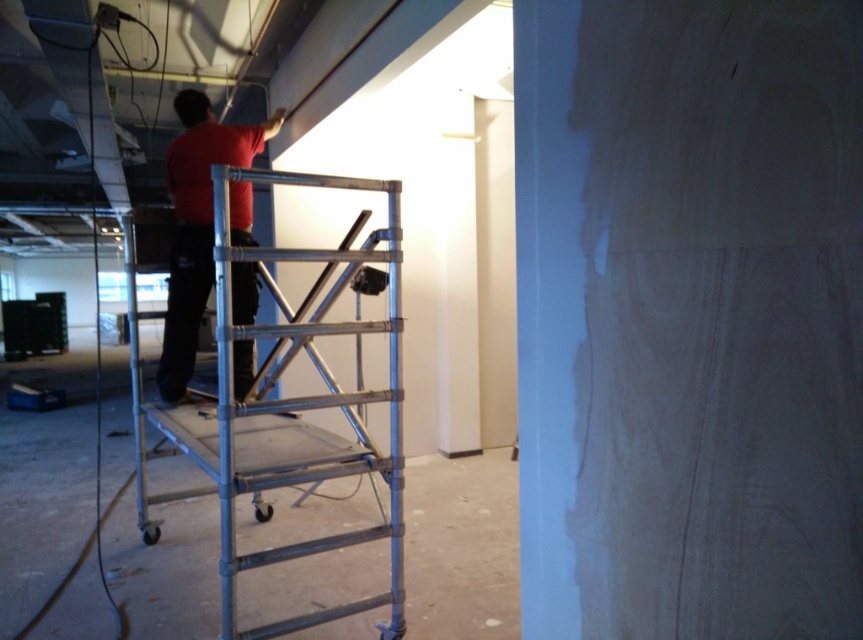
Question: Which point appears farthest from the camera in this image?

Choices:
 (A) (199, 240)
 (B) (205, 410)

Answer: (A)

Question: Where is silver metallic scaffolding at center located in relation to red matte shirt at upper center in the image?

Choices:
 (A) above
 (B) below

Answer: (B)

Question: Among these points, which one is farthest from the camera?

Choices:
 (A) (173, 150)
 (B) (282, 250)

Answer: (A)

Question: Among these points, which one is nearest to the camera?

Choices:
 (A) (250, 422)
 (B) (243, 323)

Answer: (A)

Question: Can you confirm if silver metallic scaffolding at center is wider than red matte shirt at upper center?

Choices:
 (A) yes
 (B) no

Answer: (A)

Question: Is silver metallic scaffolding at center further to the viewer compared to red matte shirt at upper center?

Choices:
 (A) yes
 (B) no

Answer: (B)